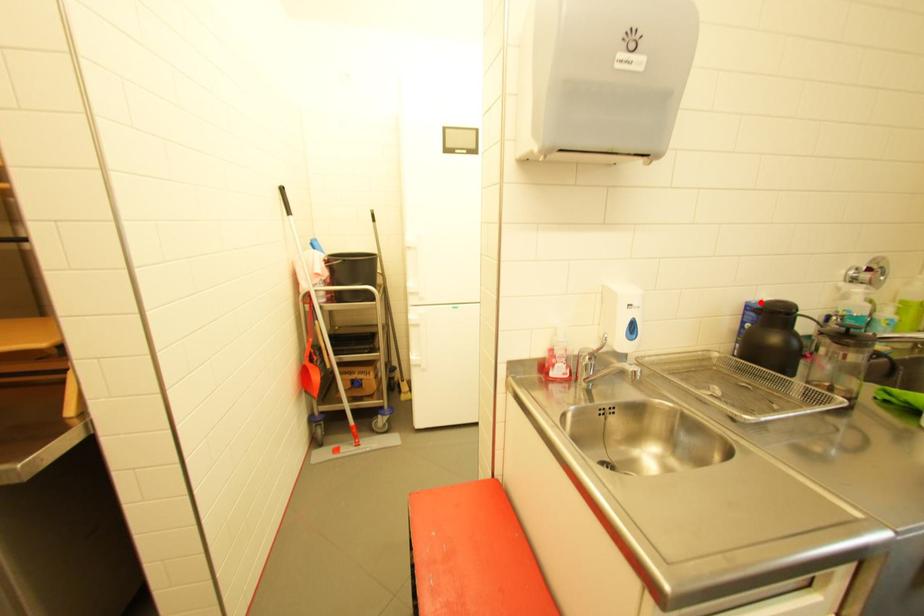
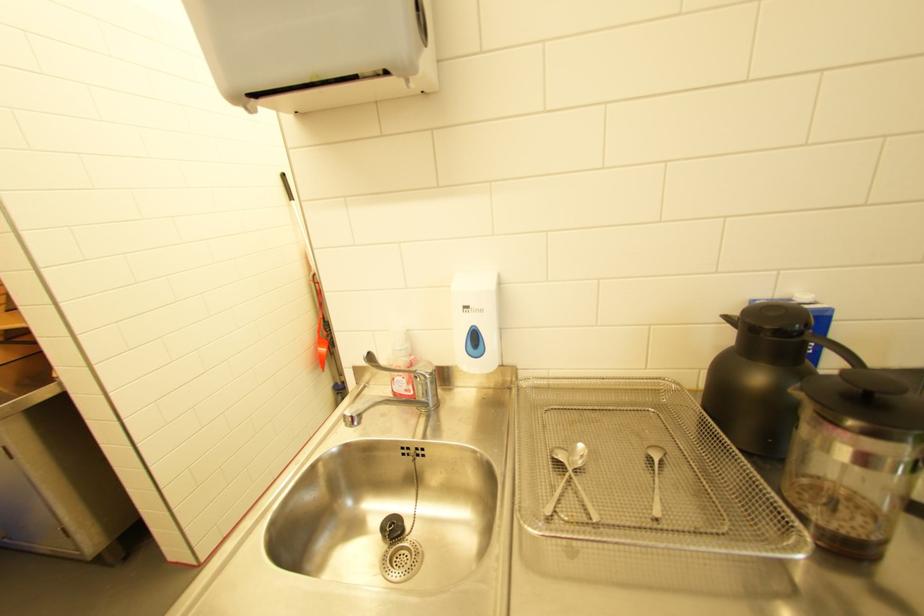
The point at the highlighted location is marked in the first image. Where is the corresponding point in the second image?

(767, 302)